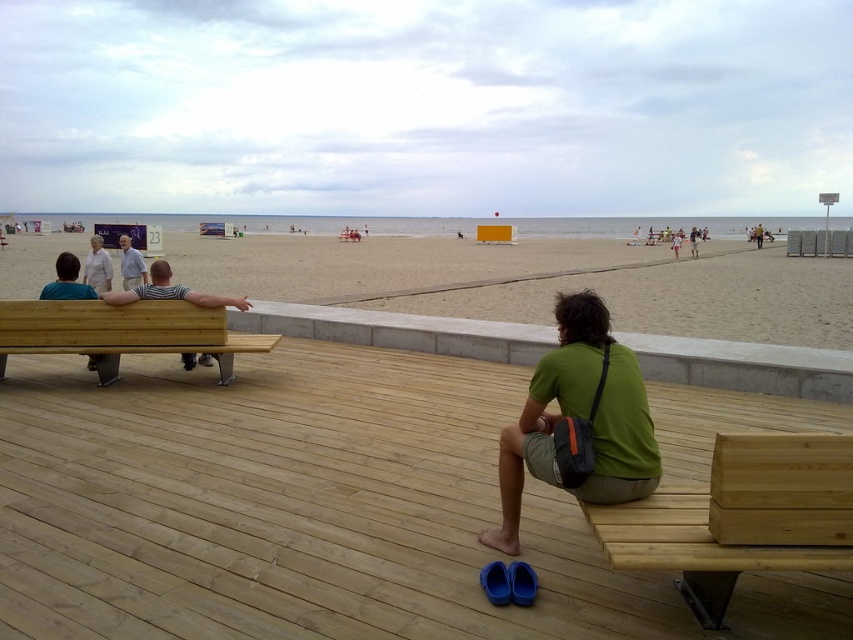
Question: Which of the following is the closest to the observer?

Choices:
 (A) light brown wooden bench at left
 (B) gray fabric shirt at left
 (C) striped cotton shirt at left
 (D) beige sand at center

Answer: (A)

Question: Which point is farther to the camera?

Choices:
 (A) (796, 464)
 (B) (820, 326)

Answer: (B)

Question: Does beige sand at center have a lesser width compared to striped cotton shirt at left?

Choices:
 (A) no
 (B) yes

Answer: (A)

Question: Which point is closer to the camera?

Choices:
 (A) striped cotton shirt at left
 (B) green fabric bag at lower center

Answer: (B)

Question: Does white cotton shirt at left have a lesser width compared to gray fabric shirt at left?

Choices:
 (A) no
 (B) yes

Answer: (B)

Question: Does light brown wooden bench at left have a greater width compared to gray fabric shirt at left?

Choices:
 (A) yes
 (B) no

Answer: (A)